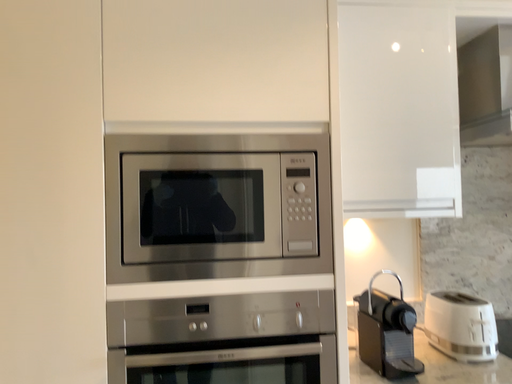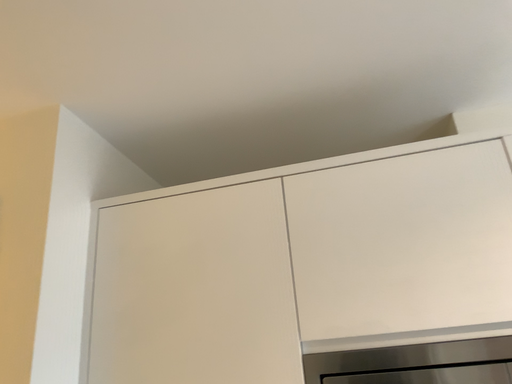
Question: How did the camera likely rotate when shooting the video?

Choices:
 (A) rotated upward
 (B) rotated downward

Answer: (A)